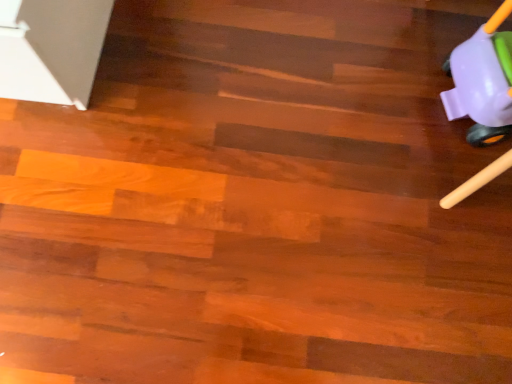
Locate an element on the screen. free spot in front of purple plastic toy at upper right is located at coordinates (446, 196).